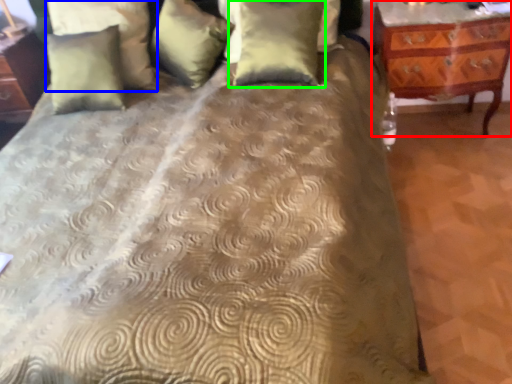
Question: Considering the real-world distances, which object is farthest from nightstand (highlighted by a red box)? pillow (highlighted by a blue box) or pillow (highlighted by a green box)?

Choices:
 (A) pillow
 (B) pillow

Answer: (A)